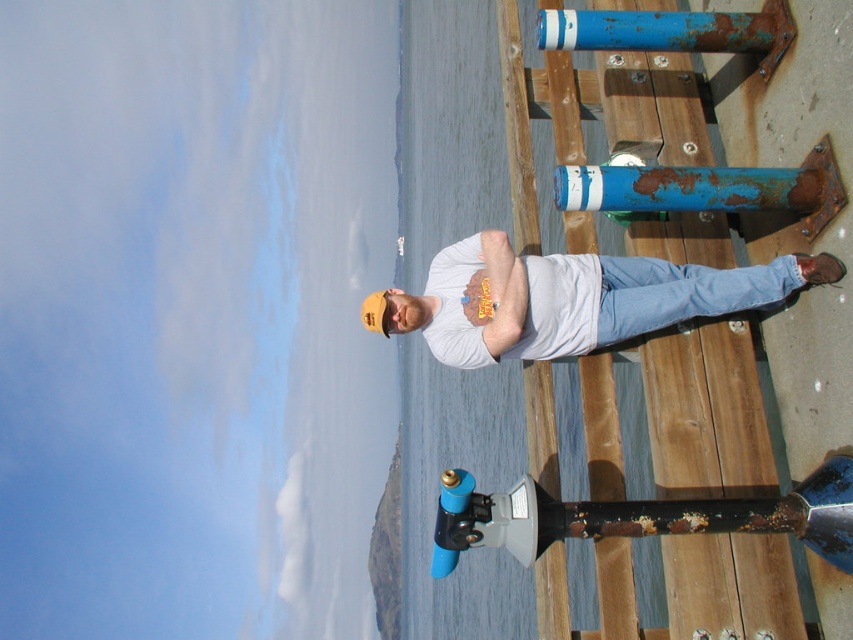
This screenshot has width=853, height=640. What do you see at coordinates (570, 298) in the screenshot?
I see `white cotton shirt at center` at bounding box center [570, 298].

Looking at this image, is white cotton shirt at center thinner than blue matte pipe at lower center?

No, white cotton shirt at center is not thinner than blue matte pipe at lower center.

Is point (639, 323) positioned in front of point (676, 509)?

No, it is behind (676, 509).

You are a GUI agent. You are given a task and a screenshot of the screen. Output one action in this format:
    pyautogui.click(x=<x>, y=<y>)
    Task: Click on the white cotton shirt at center
    The width and height of the screenshot is (853, 640).
    Given the screenshot: What is the action you would take?
    pyautogui.click(x=570, y=298)